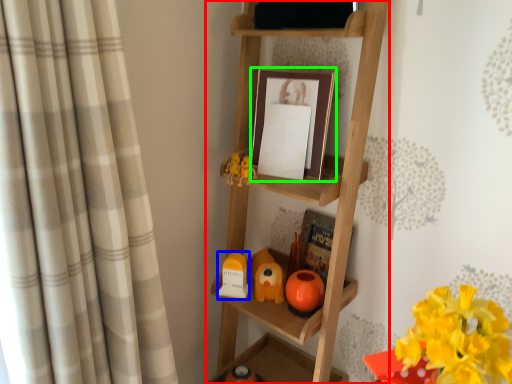
Question: Which object is the farthest from shelf (highlighted by a red box)? Choose among these: toy (highlighted by a blue box) or picture frame (highlighted by a green box).

Choices:
 (A) toy
 (B) picture frame

Answer: (A)